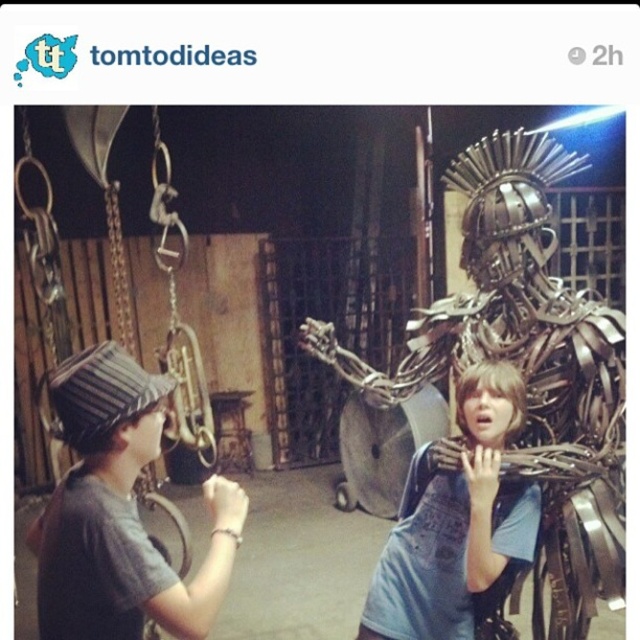
You are an art curator planning to install a new exhibit. You have a metallic armor at right and a striped fabric hat at left. Which object should you place on a higher shelf to ensure both are visible without blocking each other?

The metallic armor at right is much taller than the striped fabric hat at left, so placing the metallic armor at right on a higher shelf will prevent it from blocking the view of the striped fabric hat at left.

You are an art curator planning to move the metallic wire sculpture at center closer to the entrance. To do this, you need to determine if it is currently positioned in front of or behind the metallic armor at right. Which is it?

The metallic wire sculpture at center is behind the metallic armor at right, so it is currently positioned behind the metallic armor at right.

You are an art curator planning to move the metallic wire sculpture at center to the left side of the room. Based on the current arrangement, will moving it require adjusting the position of the metallic armor at right?

The metallic armor at right is positioned over the metallic wire sculpture at center, so moving the metallic wire sculpture at center to the left would require adjusting the metallic armor at right to ensure it is no longer blocking or overlapping with the sculpture.